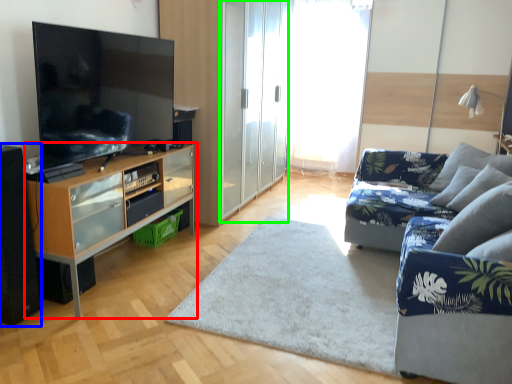
Question: Which object is positioned closest to cabinetry (highlighted by a red box)? Select from speaker (highlighted by a blue box) and screen door (highlighted by a green box).

Choices:
 (A) speaker
 (B) screen door

Answer: (A)